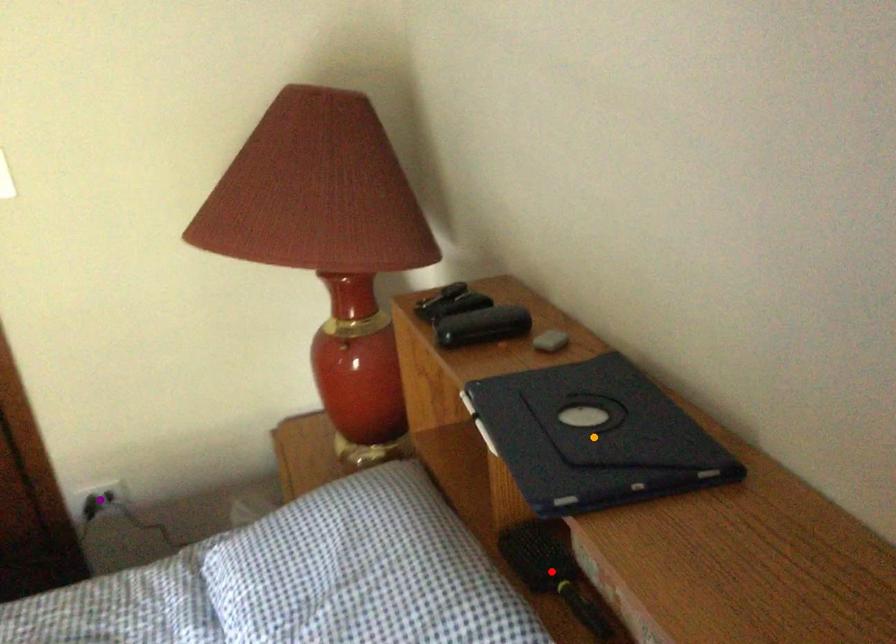
Order these from nearest to farthest:
red point, purple point, orange point

1. orange point
2. red point
3. purple point